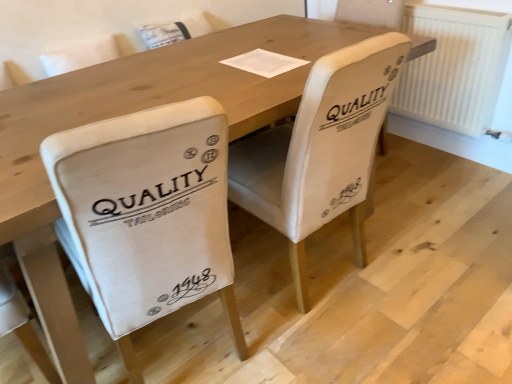
Where is `vacant area situated to the left side of white paper at center`? This screenshot has height=384, width=512. vacant area situated to the left side of white paper at center is located at coordinates (201, 64).